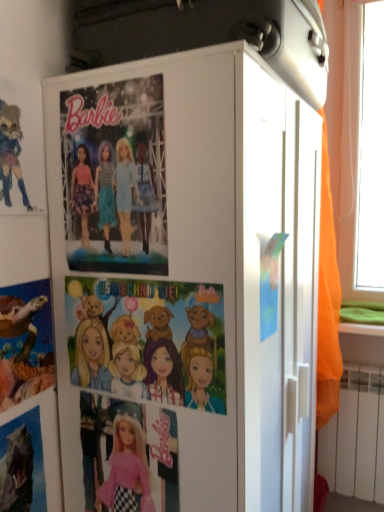
Question: Considering the relative sizes of shiny metallic dinosaur at lower left, which is counted as the 2th comic book, starting from the right, and matte paper poster at center in the image provided, is shiny metallic dinosaur at lower left, which is counted as the 2th comic book, starting from the right, bigger than matte paper poster at center?

Choices:
 (A) no
 (B) yes

Answer: (B)

Question: From the image's perspective, is shiny metallic dinosaur at lower left, which appears as the 2th comic book when viewed from the left, over matte paper poster at center?

Choices:
 (A) no
 (B) yes

Answer: (A)

Question: From a real-world perspective, is shiny metallic dinosaur at lower left, which is counted as the 2th comic book, starting from the right, on top of matte paper poster at center?

Choices:
 (A) yes
 (B) no

Answer: (B)

Question: Does shiny metallic dinosaur at lower left, which appears as the 2th comic book when viewed from the left, appear on the right side of matte paper poster at center?

Choices:
 (A) no
 (B) yes

Answer: (A)

Question: Is shiny metallic dinosaur at lower left, which appears as the 2th comic book when viewed from the left, at the left side of matte paper poster at center?

Choices:
 (A) no
 (B) yes

Answer: (B)

Question: In terms of size, does orange fabric curtain at right appear bigger or smaller than cartoon paper comic at center, which ranks as the 1th comic book in right-to-left order?

Choices:
 (A) big
 (B) small

Answer: (A)

Question: From a real-world perspective, is orange fabric curtain at right above or below cartoon paper comic at center, placed as the third comic book when sorted from left to right?

Choices:
 (A) below
 (B) above

Answer: (B)

Question: Visually, is orange fabric curtain at right positioned to the left or to the right of cartoon paper comic at center, placed as the third comic book when sorted from left to right?

Choices:
 (A) left
 (B) right

Answer: (B)

Question: Is orange fabric curtain at right wider or thinner than cartoon paper comic at center, placed as the third comic book when sorted from left to right?

Choices:
 (A) wide
 (B) thin

Answer: (A)

Question: Is white matte cabinet at center taller or shorter than orange fabric curtain at right?

Choices:
 (A) short
 (B) tall

Answer: (A)

Question: Relative to orange fabric curtain at right, is white matte cabinet at center in front or behind?

Choices:
 (A) front
 (B) behind

Answer: (A)

Question: From a real-world perspective, is white matte cabinet at center above or below orange fabric curtain at right?

Choices:
 (A) below
 (B) above

Answer: (A)

Question: Is point (153, 200) closer or farther from the camera than point (334, 336)?

Choices:
 (A) farther
 (B) closer

Answer: (B)

Question: From a real-world perspective, is shiny metallic dinosaur at lower left, which appears as the 2th comic book when viewed from the left, above or below matte plastic turtle at lower left, which ranks as the 3th comic book in right-to-left order?

Choices:
 (A) above
 (B) below

Answer: (B)

Question: Is shiny metallic dinosaur at lower left, which appears as the 2th comic book when viewed from the left, to the left or to the right of matte plastic turtle at lower left, arranged as the first comic book when viewed from the left, in the image?

Choices:
 (A) left
 (B) right

Answer: (B)